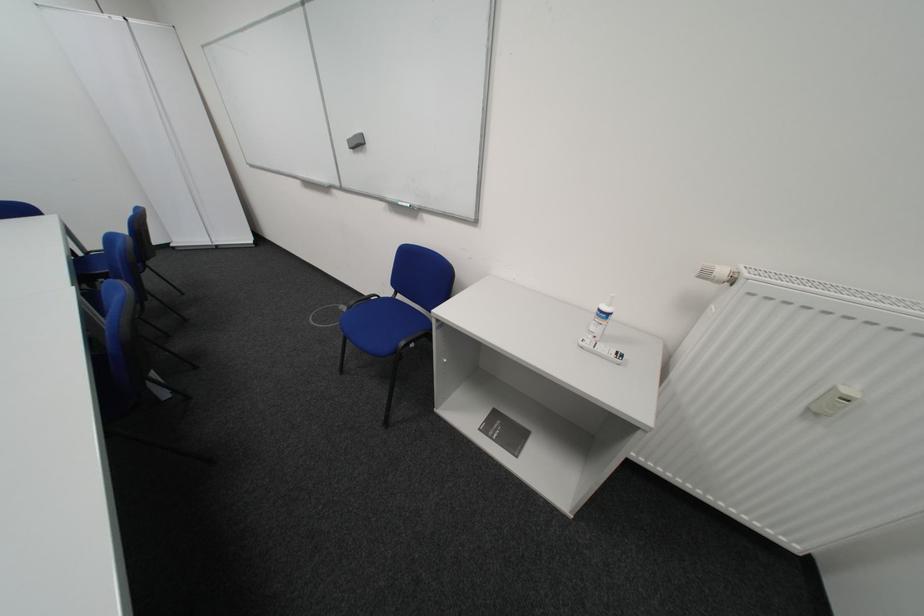
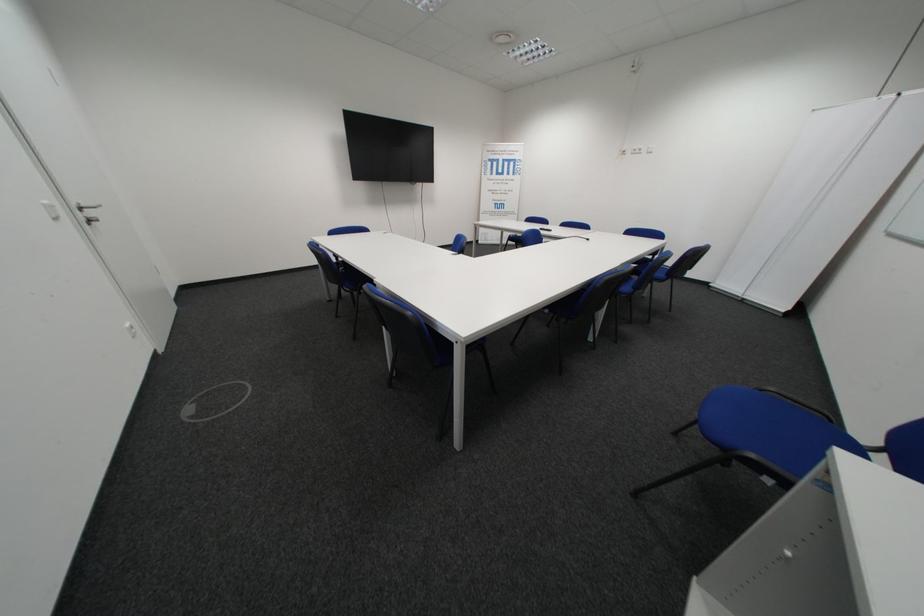
The images are taken continuously from a first-person perspective. In which direction is your viewpoint rotating?

The rotation direction of the camera is left-down.